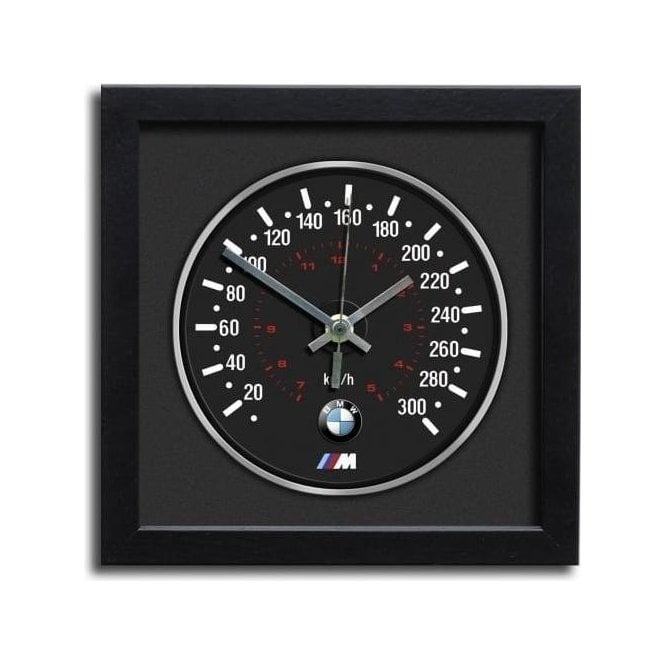
At what (x,y) coordinates should I click in order to perform the action: click on frame. Please return your answer as a coordinate pair (x, y). The image size is (665, 665). Looking at the image, I should click on (354, 539).